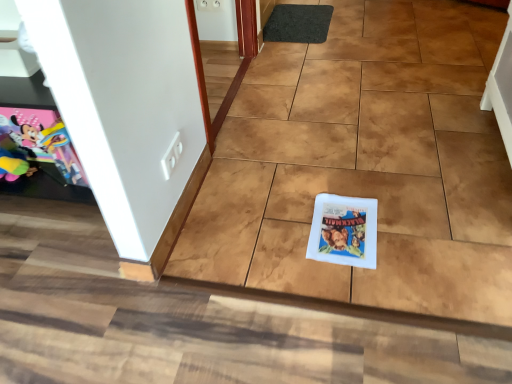
The image size is (512, 384). What do you see at coordinates (298, 23) in the screenshot? I see `black rubber doormat at upper center` at bounding box center [298, 23].

The height and width of the screenshot is (384, 512). Identify the location of matte paper comic book at left, which is the 1th comic book from top to bottom. (36, 145).

The height and width of the screenshot is (384, 512). What do you see at coordinates (344, 231) in the screenshot?
I see `white paper comic book at center, which is the second comic book from top to bottom` at bounding box center [344, 231].

Identify the location of black rubber doormat at upper center. (298, 23).

From the picture: Considering the positions of objects black rubber doormat at upper center and white paper comic book at center, which is the second comic book from top to bottom, in the image provided, who is more to the right, black rubber doormat at upper center or white paper comic book at center, which is the second comic book from top to bottom,?

white paper comic book at center, which is the second comic book from top to bottom, is more to the right.

Is point (327, 13) closer or farther from the camera than point (376, 228)?

Clearly, point (327, 13) is more distant from the camera than point (376, 228).

From a real-world perspective, which is physically above, black rubber doormat at upper center or white paper comic book at center, which is the 1th comic book in right-to-left order?

From a 3D spatial view, black rubber doormat at upper center is above.

Considering the sizes of objects white paper comic book at center, which is the second comic book from top to bottom, and matte paper comic book at left, which appears as the 1th comic book when viewed from the left, in the image provided, who is wider, white paper comic book at center, which is the second comic book from top to bottom, or matte paper comic book at left, which appears as the 1th comic book when viewed from the left,?

With larger width is white paper comic book at center, which is the second comic book from top to bottom.

Is white paper comic book at center, which is the 1th comic book from bottom to top, aimed at matte paper comic book at left, which is the 1th comic book from top to bottom?

No, white paper comic book at center, which is the 1th comic book from bottom to top, is not facing towards matte paper comic book at left, which is the 1th comic book from top to bottom.

From the image's perspective, is white paper comic book at center, acting as the second comic book starting from the left, positioned above or below matte paper comic book at left, which is the 1th comic book from top to bottom?

white paper comic book at center, acting as the second comic book starting from the left, is situated lower than matte paper comic book at left, which is the 1th comic book from top to bottom, in the image.

Considering the sizes of objects white paper comic book at center, which is the 1th comic book in right-to-left order, and matte paper comic book at left, the 2th comic book in the right-to-left sequence, in the image provided, who is taller, white paper comic book at center, which is the 1th comic book in right-to-left order, or matte paper comic book at left, the 2th comic book in the right-to-left sequence,?

Standing taller between the two is matte paper comic book at left, the 2th comic book in the right-to-left sequence.

Can you confirm if matte paper comic book at left, the 2th comic book in the right-to-left sequence, is positioned to the left of black rubber doormat at upper center?

Correct, you'll find matte paper comic book at left, the 2th comic book in the right-to-left sequence, to the left of black rubber doormat at upper center.

Is black rubber doormat at upper center completely or partially inside matte paper comic book at left, which is the 1th comic book from top to bottom?

No, matte paper comic book at left, which is the 1th comic book from top to bottom, does not contain black rubber doormat at upper center.

Can you confirm if matte paper comic book at left, which appears as the 1th comic book when viewed from the left, is wider than black rubber doormat at upper center?

In fact, matte paper comic book at left, which appears as the 1th comic book when viewed from the left, might be narrower than black rubber doormat at upper center.

From the picture: From the image's perspective, is matte paper comic book at left, which ranks as the second comic book in bottom-to-top order, above or below black rubber doormat at upper center?

Clearly, from the image's perspective, matte paper comic book at left, which ranks as the second comic book in bottom-to-top order, is below black rubber doormat at upper center.

Considering the points (331, 242) and (295, 34), which point is behind, point (331, 242) or point (295, 34)?

The point (295, 34) is farther.

Considering the positions of objects white paper comic book at center, which is the second comic book from top to bottom, and black rubber doormat at upper center in the image provided, who is behind, white paper comic book at center, which is the second comic book from top to bottom, or black rubber doormat at upper center?

black rubber doormat at upper center.

Is white paper comic book at center, which is the 1th comic book in right-to-left order, not inside black rubber doormat at upper center?

Yes, white paper comic book at center, which is the 1th comic book in right-to-left order, is not within black rubber doormat at upper center.

Is white paper comic book at center, acting as the second comic book starting from the left, in contact with black rubber doormat at upper center?

No, white paper comic book at center, acting as the second comic book starting from the left, is not making contact with black rubber doormat at upper center.

From the image's perspective, is black rubber doormat at upper center under matte paper comic book at left, which is the 1th comic book from top to bottom?

Incorrect, from the image's perspective, black rubber doormat at upper center is higher than matte paper comic book at left, which is the 1th comic book from top to bottom.

Based on their positions, is black rubber doormat at upper center located to the left or right of matte paper comic book at left, which ranks as the second comic book in bottom-to-top order?

Clearly, black rubber doormat at upper center is on the right of matte paper comic book at left, which ranks as the second comic book in bottom-to-top order, in the image.

Is black rubber doormat at upper center outside of matte paper comic book at left, which is the 1th comic book from top to bottom?

Yes, black rubber doormat at upper center is outside of matte paper comic book at left, which is the 1th comic book from top to bottom.

Between black rubber doormat at upper center and matte paper comic book at left, which appears as the 1th comic book when viewed from the left, which one has larger width?

With larger width is black rubber doormat at upper center.

Considering the positions of objects matte paper comic book at left, which appears as the 1th comic book when viewed from the left, and white paper comic book at center, acting as the second comic book starting from the left, in the image provided, who is more to the right, matte paper comic book at left, which appears as the 1th comic book when viewed from the left, or white paper comic book at center, acting as the second comic book starting from the left,?

white paper comic book at center, acting as the second comic book starting from the left.

Which point is more distant from viewer, (25, 174) or (340, 210)?

The point (340, 210) is behind.

How much distance is there between matte paper comic book at left, the 2th comic book in the right-to-left sequence, and white paper comic book at center, which is the second comic book from top to bottom?

The distance of matte paper comic book at left, the 2th comic book in the right-to-left sequence, from white paper comic book at center, which is the second comic book from top to bottom, is 92.77 centimeters.

Is the position of matte paper comic book at left, which ranks as the second comic book in bottom-to-top order, less distant than that of white paper comic book at center, which is the second comic book from top to bottom?

No, matte paper comic book at left, which ranks as the second comic book in bottom-to-top order, is further to the viewer.

Locate an element on the screen. The height and width of the screenshot is (384, 512). comic book that is the 2nd one when counting downward from the black rubber doormat at upper center (from the image's perspective) is located at coordinates (344, 231).

Locate an element on the screen. Image resolution: width=512 pixels, height=384 pixels. comic book on the left of white paper comic book at center, which is the 1th comic book in right-to-left order is located at coordinates (36, 145).

Based on their spatial positions, is matte paper comic book at left, which is the 1th comic book from top to bottom, or black rubber doormat at upper center closer to white paper comic book at center, which is the 1th comic book in right-to-left order?

matte paper comic book at left, which is the 1th comic book from top to bottom, lies closer to white paper comic book at center, which is the 1th comic book in right-to-left order, than the other object.

When comparing their distances from matte paper comic book at left, the 2th comic book in the right-to-left sequence, does white paper comic book at center, which is the 1th comic book in right-to-left order, or black rubber doormat at upper center seem closer?

white paper comic book at center, which is the 1th comic book in right-to-left order, is positioned closer to the anchor matte paper comic book at left, the 2th comic book in the right-to-left sequence.

Looking at the image, which one is located further to white paper comic book at center, which is the second comic book from top to bottom, black rubber doormat at upper center or matte paper comic book at left, which appears as the 1th comic book when viewed from the left?

black rubber doormat at upper center lies further to white paper comic book at center, which is the second comic book from top to bottom, than the other object.

Considering their positions, is matte paper comic book at left, the 2th comic book in the right-to-left sequence, positioned further to black rubber doormat at upper center than white paper comic book at center, acting as the second comic book starting from the left?

matte paper comic book at left, the 2th comic book in the right-to-left sequence.

Based on their spatial positions, is black rubber doormat at upper center or white paper comic book at center, which is the second comic book from top to bottom, closer to matte paper comic book at left, which is the 1th comic book from top to bottom?

The object closer to matte paper comic book at left, which is the 1th comic book from top to bottom, is white paper comic book at center, which is the second comic book from top to bottom.

From the image, which object appears to be farther from black rubber doormat at upper center, white paper comic book at center, acting as the second comic book starting from the left, or matte paper comic book at left, which appears as the 1th comic book when viewed from the left?

matte paper comic book at left, which appears as the 1th comic book when viewed from the left.

The height and width of the screenshot is (384, 512). What are the coordinates of `comic book between white paper comic book at center, which is the second comic book from top to bottom, and black rubber doormat at upper center in the front-back direction` in the screenshot? It's located at (36, 145).